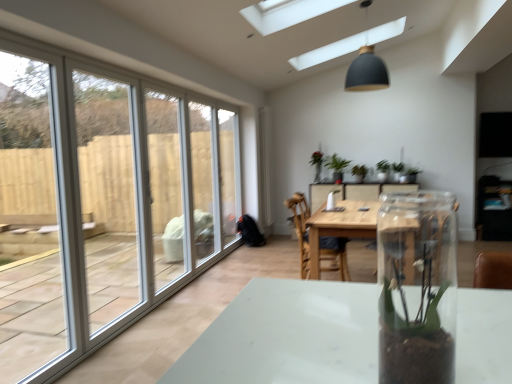
The image size is (512, 384). In order to click on free space above white plastic window frame at left (from a real-world perspective) in this screenshot , I will do `click(31, 39)`.